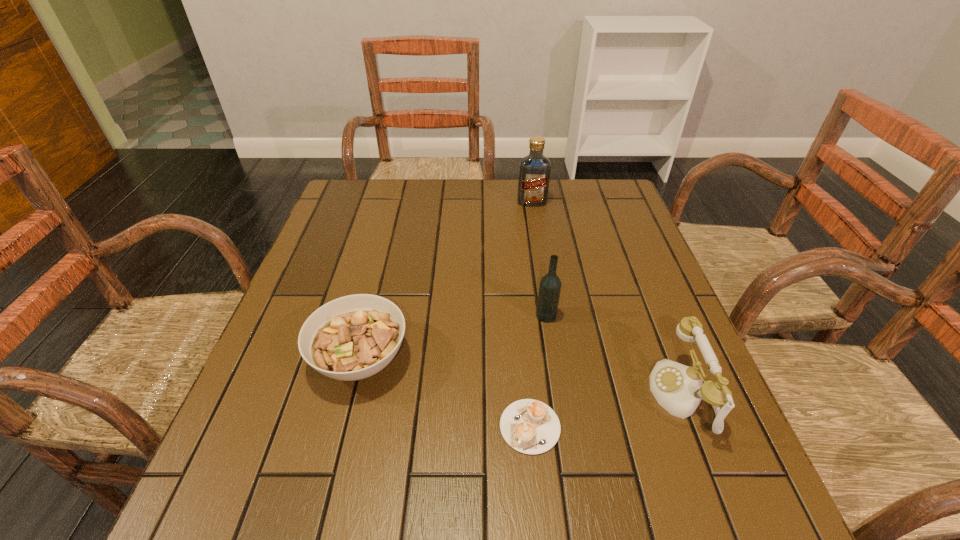
At what (x,y) coordinates should I click in order to perform the action: click on free space that is in between the rightmost object and the tallest object. Please return your answer as a coordinate pair (x, y). This screenshot has width=960, height=540. Looking at the image, I should click on (607, 299).

This screenshot has width=960, height=540. What are the coordinates of `vacant space in between the nearer vodka and the telephone` in the screenshot? It's located at point(614,355).

Where is `vacant point located between the shortest object and the taller vodka`? This screenshot has height=540, width=960. vacant point located between the shortest object and the taller vodka is located at coordinates (531, 314).

Locate an element on the screen. The height and width of the screenshot is (540, 960). blank region between the shortest object and the third tallest object is located at coordinates (606, 411).

Find the location of `vacant space that is in between the tallest object and the shortest object`. vacant space that is in between the tallest object and the shortest object is located at coordinates (531, 314).

Identify which object is the third nearest to the second tallest object. Please provide its 2D coordinates. Your answer should be formatted as a tuple, i.e. [(x, y)], where the tuple contains the x and y coordinates of a point satisfying the conditions above.

[(353, 337)]

You are a GUI agent. You are given a task and a screenshot of the screen. Output one action in this format:
    pyautogui.click(x=<x>, y=<y>)
    Task: Click on the object that ranks as the fourth closest to the telephone
    Image resolution: width=960 pixels, height=540 pixels.
    Given the screenshot: What is the action you would take?
    tap(534, 170)

The image size is (960, 540). In order to click on vacant point that satisfies the following two spatial constraints: 1. on the back side of the shorter vodka; 2. on the left side of the shortest object in this screenshot , I will do `click(519, 315)`.